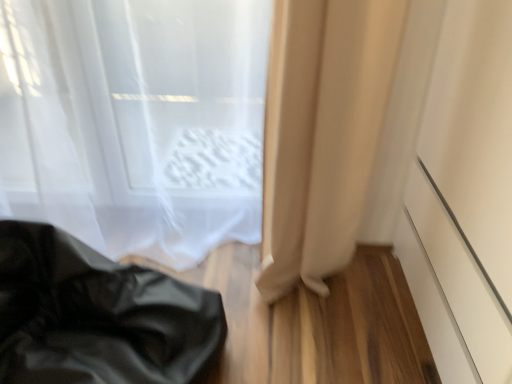
Image resolution: width=512 pixels, height=384 pixels. What are the coordinates of `vacant space in beige fabric curtain at lower right, which is counted as the second curtain, starting from the left (from a real-world perspective)` in the screenshot? It's located at (338, 286).